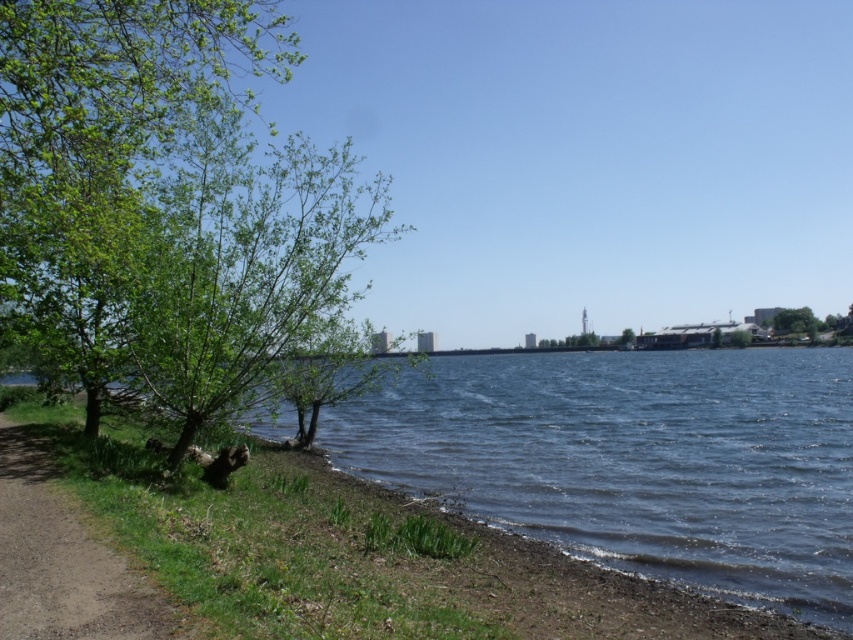
The width and height of the screenshot is (853, 640). What do you see at coordinates (62, 563) in the screenshot?
I see `dirt/gravel path at lower left` at bounding box center [62, 563].

Can you confirm if dirt/gravel path at lower left is positioned below green leafy tree at center?

Yes, dirt/gravel path at lower left is below green leafy tree at center.

Is point (41, 461) more distant than point (631, 348)?

No.

You are a GUI agent. You are given a task and a screenshot of the screen. Output one action in this format:
    pyautogui.click(x=<x>, y=<y>)
    Task: Click on the dirt/gravel path at lower left
    The height and width of the screenshot is (640, 853).
    Given the screenshot: What is the action you would take?
    pyautogui.click(x=62, y=563)

Is green leafy tree at left shorter than green leafy tree at center?

In fact, green leafy tree at left may be taller than green leafy tree at center.

The width and height of the screenshot is (853, 640). Identify the location of green leafy tree at left. (161, 198).

This screenshot has height=640, width=853. In order to click on green leafy tree at left in this screenshot , I will do `click(161, 198)`.

Where is `dirt/gravel path at lower left`? This screenshot has height=640, width=853. dirt/gravel path at lower left is located at coordinates (62, 563).

Which is behind, point (13, 630) or point (773, 321)?

The point (773, 321) is more distant.

Is point (102, 577) farther from viewer compared to point (793, 317)?

That is False.

Image resolution: width=853 pixels, height=640 pixels. Identify the location of dirt/gravel path at lower left. (62, 563).